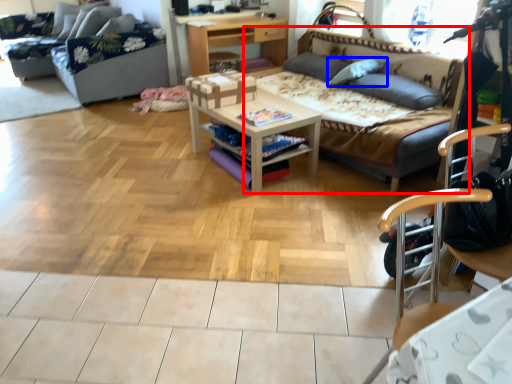
Question: Among these objects, which one is nearest to the camera, studio couch (highlighted by a red box) or pillow (highlighted by a blue box)?

Choices:
 (A) studio couch
 (B) pillow

Answer: (A)